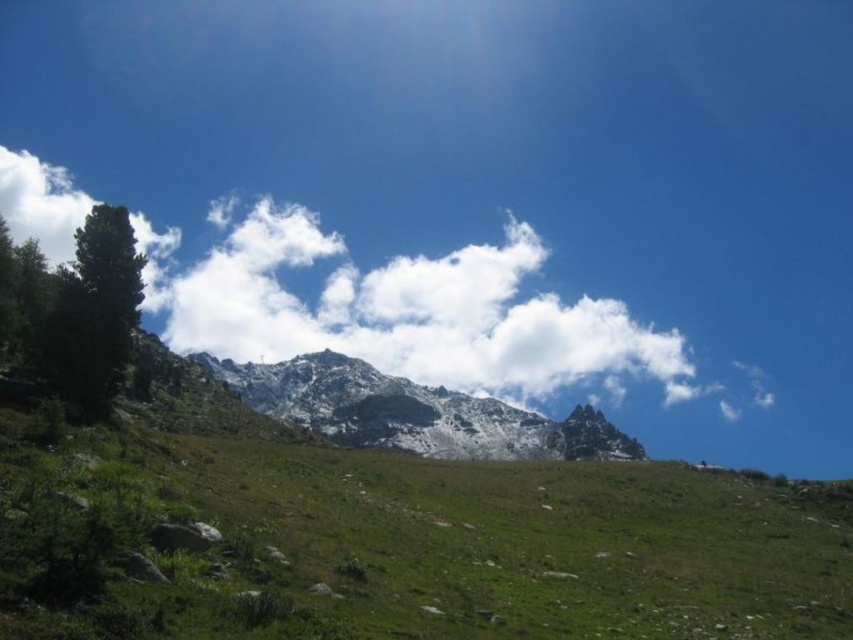
Question: Which of the following is the closest to the observer?

Choices:
 (A) white fluffy cloud at upper center
 (B) white snow-covered mountain at center
 (C) green grassy at center

Answer: (C)

Question: Observing the image, what is the correct spatial positioning of white fluffy cloud at upper center in reference to white snow-covered mountain at center?

Choices:
 (A) right
 (B) left

Answer: (B)

Question: Does green grassy at center have a lesser width compared to white snow-covered mountain at center?

Choices:
 (A) no
 (B) yes

Answer: (B)

Question: Which point appears farthest from the camera in this image?

Choices:
 (A) (289, 330)
 (B) (374, 372)
 (C) (633, 540)

Answer: (A)

Question: Does green grassy at center have a larger size compared to white snow-covered mountain at center?

Choices:
 (A) no
 (B) yes

Answer: (A)

Question: Which point is farther to the camera?

Choices:
 (A) (469, 534)
 (B) (531, 272)

Answer: (B)